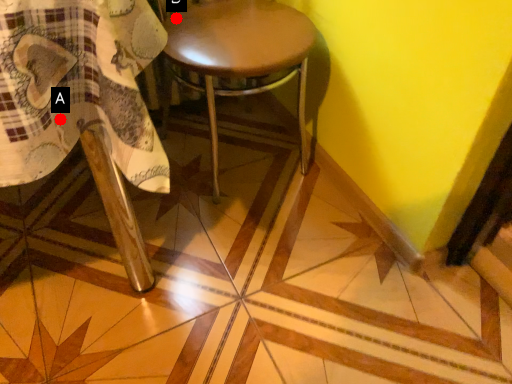
Question: Two points are circled on the image, labeled by A and B beside each circle. Which point is further to the camera?

Choices:
 (A) A is further
 (B) B is further

Answer: (B)